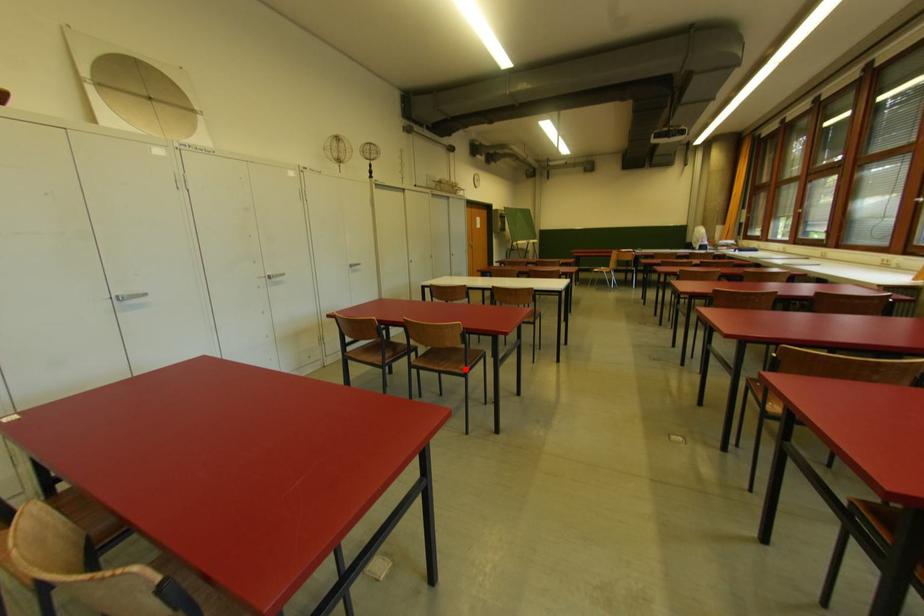
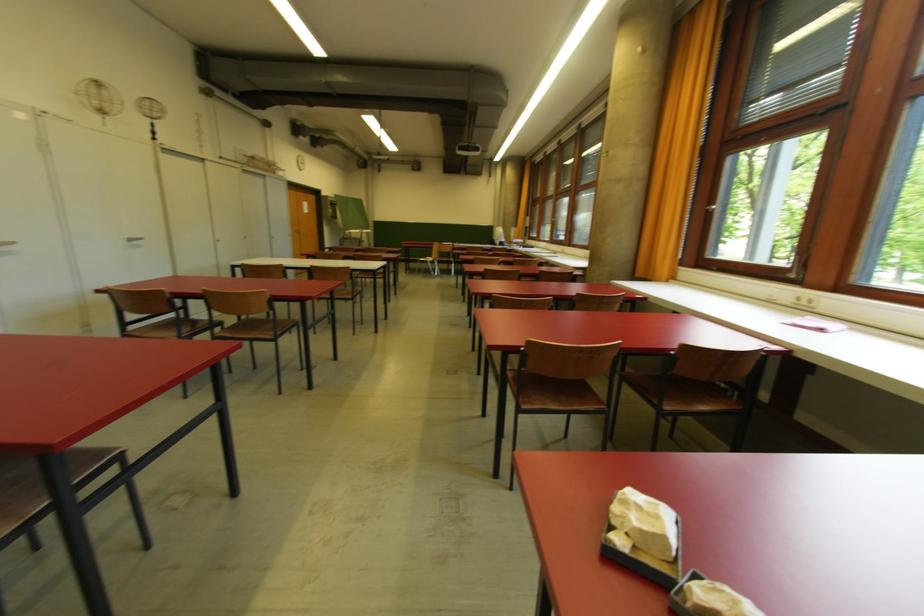
The point at the highlighted location is marked in the first image. Where is the corresponding point in the second image?

(274, 334)